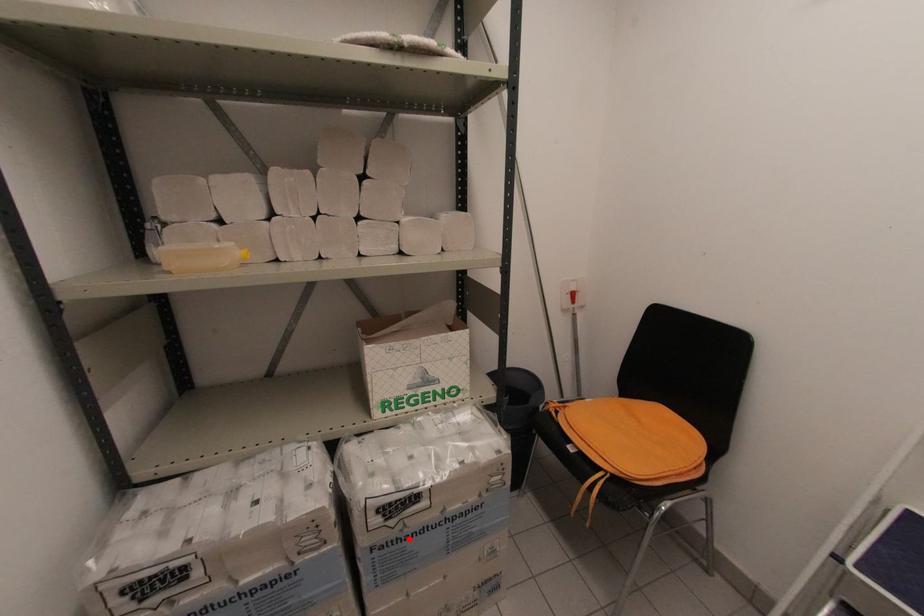
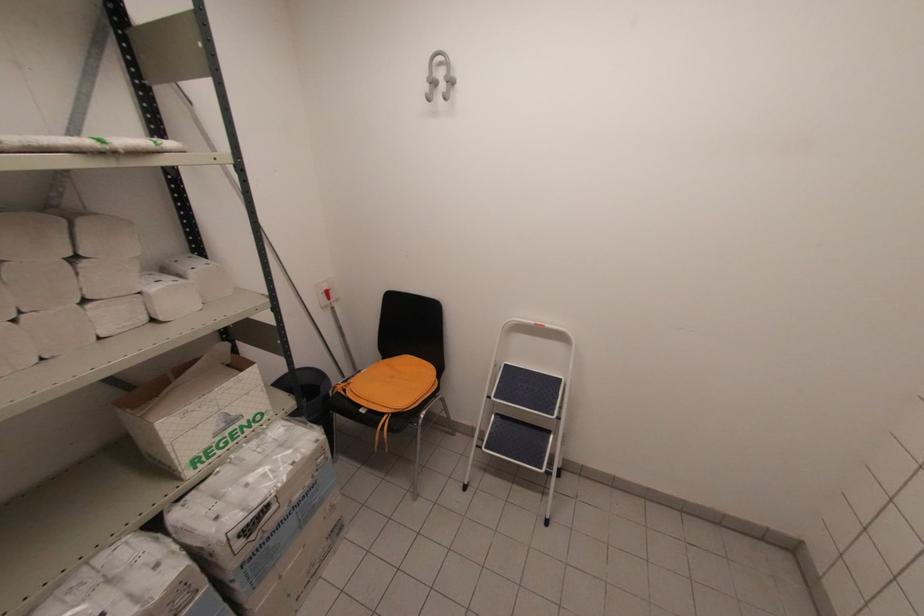
Where in the second image is the point corresponding to the highlighted location from the first image?

(271, 539)